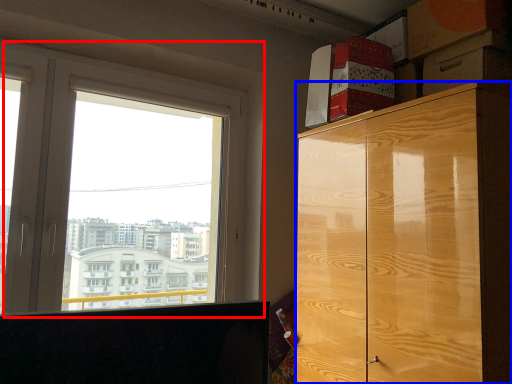
Question: Which object appears closest to the camera in this image, window (highlighted by a red box) or cabinetry (highlighted by a blue box)?

Choices:
 (A) window
 (B) cabinetry

Answer: (B)